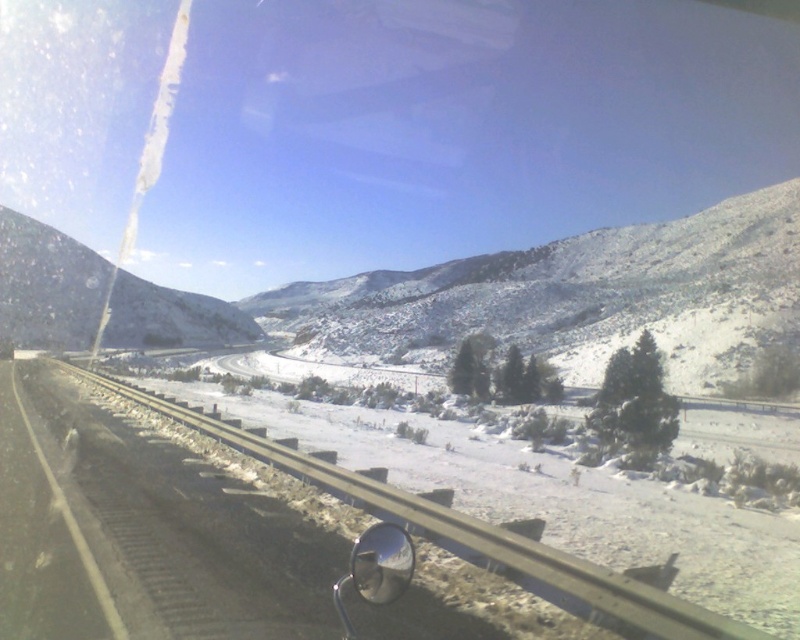
Does snowy rocky mountain at left appear under glossy metallic view mirror at lower center?

No.

Is point (68, 244) more distant than point (406, 561)?

Yes, it is.

I want to click on snowy rocky mountain at left, so click(x=97, y=298).

Between snowy rocky mountain at center and snowy rocky mountain at left, which one has less height?

With less height is snowy rocky mountain at left.

From the picture: Is snowy rocky mountain at center to the right of snowy rocky mountain at left from the viewer's perspective?

Correct, you'll find snowy rocky mountain at center to the right of snowy rocky mountain at left.

The image size is (800, 640). In order to click on snowy rocky mountain at center in this screenshot , I will do [x=574, y=296].

Where is `snowy rocky mountain at center`? The image size is (800, 640). snowy rocky mountain at center is located at coordinates (574, 296).

Does snowy rocky mountain at center appear under glossy metallic view mirror at lower center?

No.

Is point (402, 337) positioned before point (368, 579)?

No, (402, 337) is further to viewer.

Is point (484, 291) less distant than point (392, 573)?

No, (484, 291) is behind (392, 573).

At what (x,y) coordinates should I click in order to perform the action: click on snowy rocky mountain at center. Please return your answer as a coordinate pair (x, y). The height and width of the screenshot is (640, 800). Looking at the image, I should click on (574, 296).